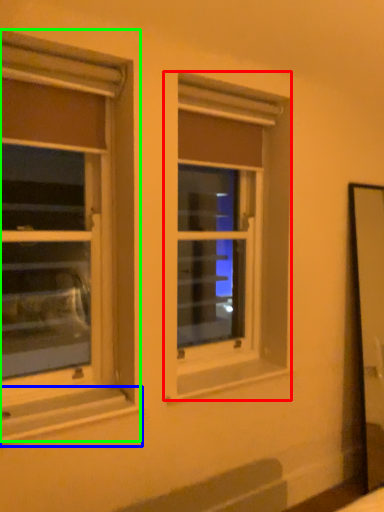
Question: Which is farther away from window (highlighted by a red box)? window sill (highlighted by a blue box) or window (highlighted by a green box)?

Choices:
 (A) window sill
 (B) window

Answer: (B)